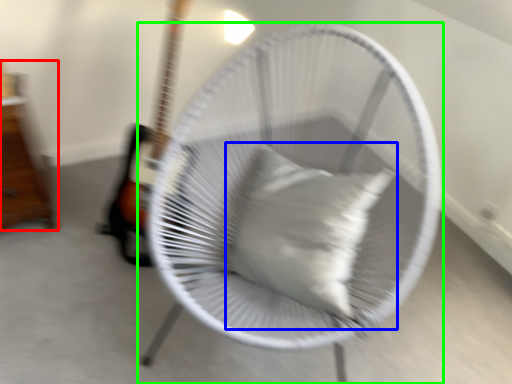
Question: Which is farther away from furniture (highlighted by a red box)? pillow (highlighted by a blue box) or mechanical fan (highlighted by a green box)?

Choices:
 (A) pillow
 (B) mechanical fan

Answer: (A)